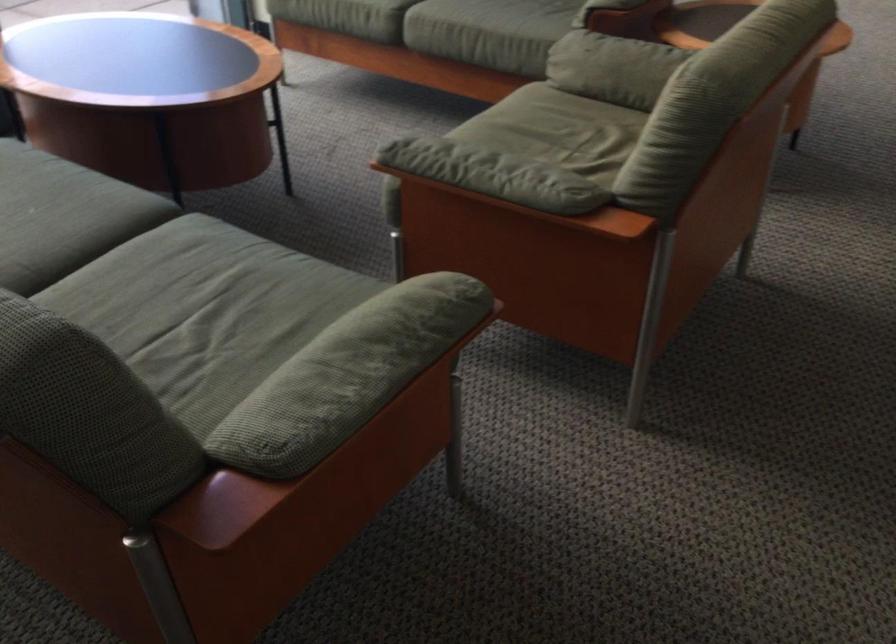
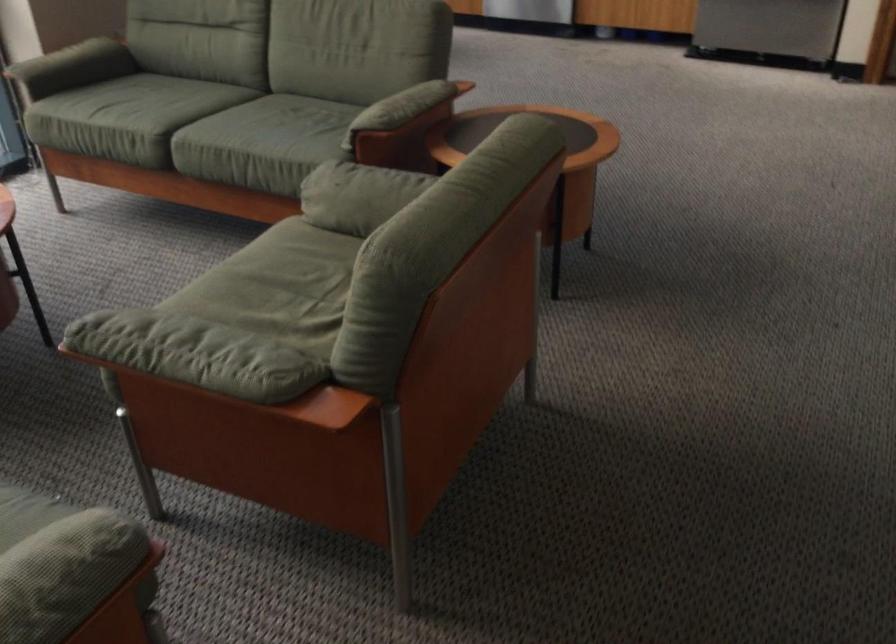
In the second image, find the point that corresponds to point 435,305 in the first image.

(71, 559)